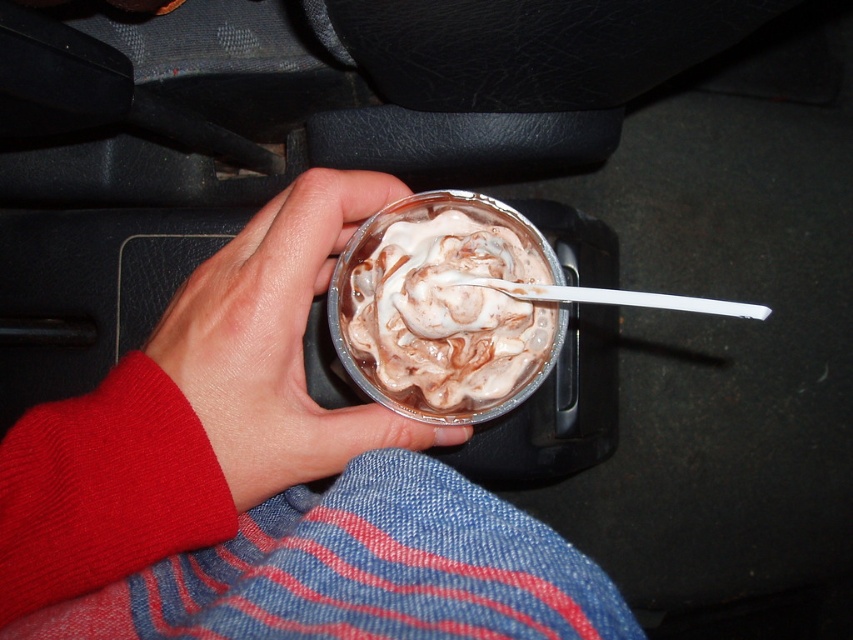
You are a delivery driver who just finished a long route and are now sitting in your car. You have a smooth skin hand at center holding a chocolate frosted cupcake at center. Can your hand reach the cupcake to take a bite?

The distance between the smooth skin hand at center and the chocolate frosted cupcake at center is 1.89 inches, so yes, the hand can easily reach the cupcake to take a bite since the distance is minimal.

You are a chef trying to place the smooth skin hand at center and the chocolate frosted cupcake at center onto a small plate. Can you fit both items on the plate without overlapping?

The smooth skin hand at center might be wider than chocolate frosted cupcake at center, so it is uncertain if both can fit on the plate without overlapping. Measure the plate size first.